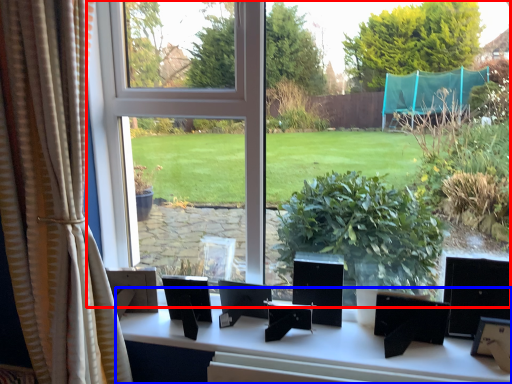
Question: Which object is further to the camera taking this photo, window (highlighted by a red box) or table (highlighted by a blue box)?

Choices:
 (A) window
 (B) table

Answer: (B)